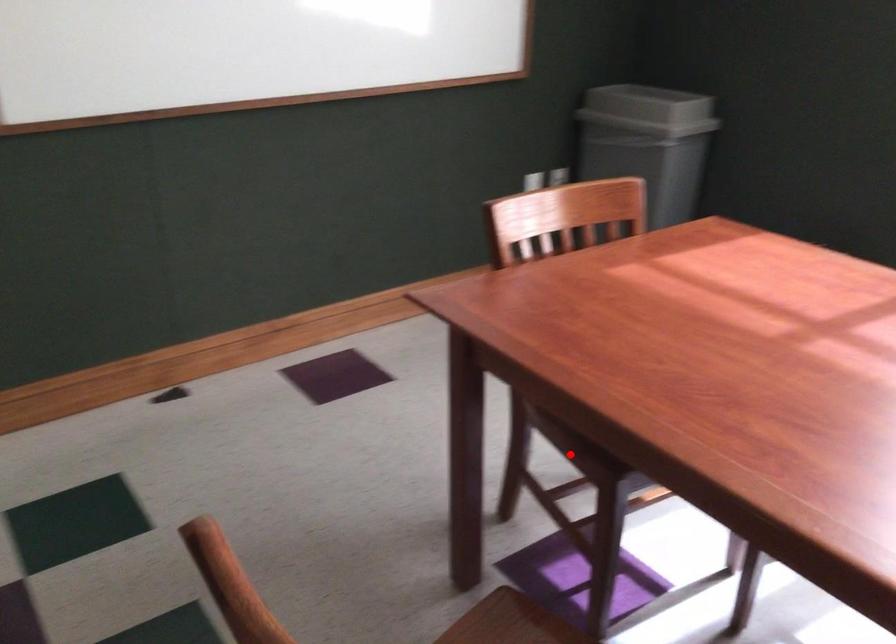
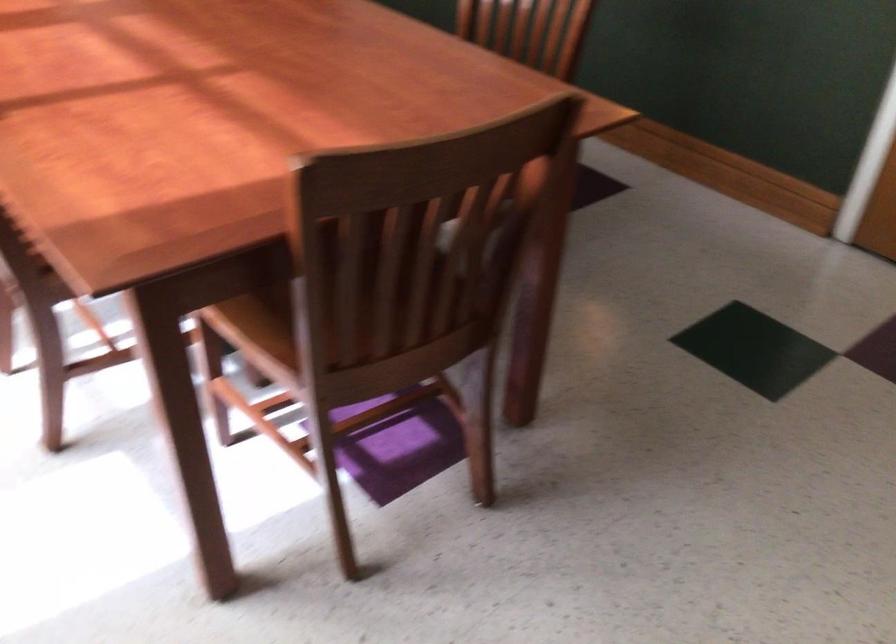
Question: I am providing you with two images of the same scene from different viewpoints. A red point is marked on the first image. Is the red point's position out of view in image 2?

Choices:
 (A) Yes
 (B) No

Answer: (A)